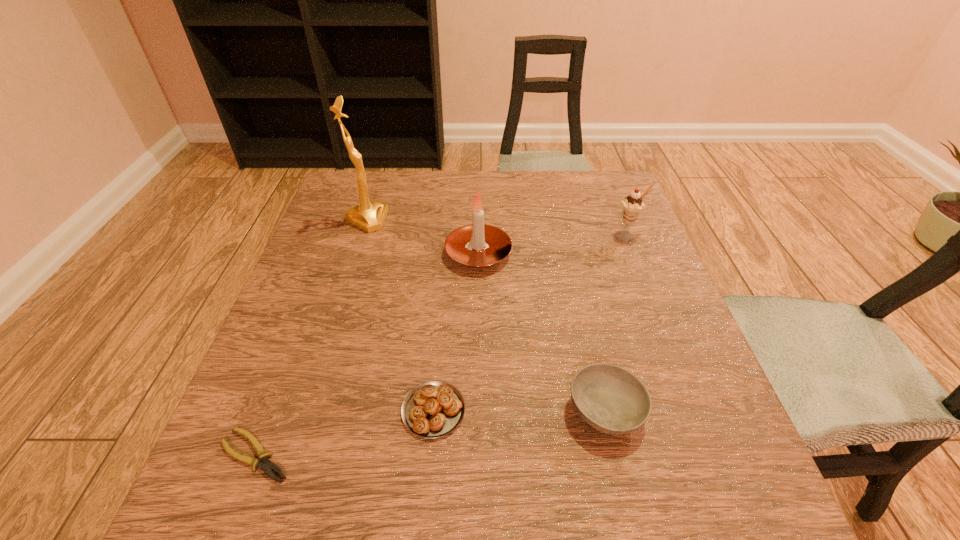
Where is `free spot that satisfies the following two spatial constraints: 1. on the front-facing side of the award; 2. on the back side of the candle`? Image resolution: width=960 pixels, height=540 pixels. free spot that satisfies the following two spatial constraints: 1. on the front-facing side of the award; 2. on the back side of the candle is located at coordinates (356, 254).

The image size is (960, 540). In order to click on vacant space that satisfies the following two spatial constraints: 1. on the back side of the rightmost object; 2. on the front-facing side of the tallest object in this screenshot , I will do pos(621,220).

Where is `blank space that satisfies the following two spatial constraints: 1. on the front side of the fourth tallest object; 2. on the left side of the pastry`? This screenshot has height=540, width=960. blank space that satisfies the following two spatial constraints: 1. on the front side of the fourth tallest object; 2. on the left side of the pastry is located at coordinates (434, 411).

The image size is (960, 540). I want to click on free spot that satisfies the following two spatial constraints: 1. on the back side of the second shortest object; 2. on the front-facing side of the award, so click(450, 220).

In order to click on free space in the image that satisfies the following two spatial constraints: 1. on the front-facing side of the award; 2. on the back side of the icecream in this screenshot , I will do `click(362, 235)`.

The height and width of the screenshot is (540, 960). Identify the location of free location that satisfies the following two spatial constraints: 1. on the front-facing side of the award; 2. on the back side of the second shortest object. (306, 410).

At what (x,y) coordinates should I click in order to perform the action: click on free location that satisfies the following two spatial constraints: 1. on the front-facing side of the award; 2. on the right side of the icecream. Please return your answer as a coordinate pair (x, y). Image resolution: width=960 pixels, height=540 pixels. Looking at the image, I should click on (362, 235).

Find the location of a particular element. vacant space that satisfies the following two spatial constraints: 1. on the back side of the icecream; 2. on the front-facing side of the tallest object is located at coordinates (621, 220).